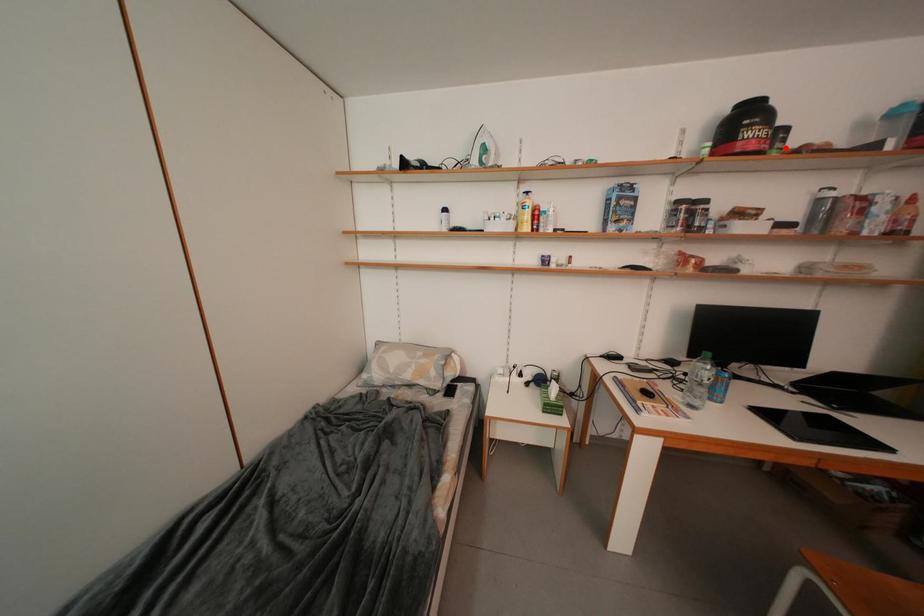
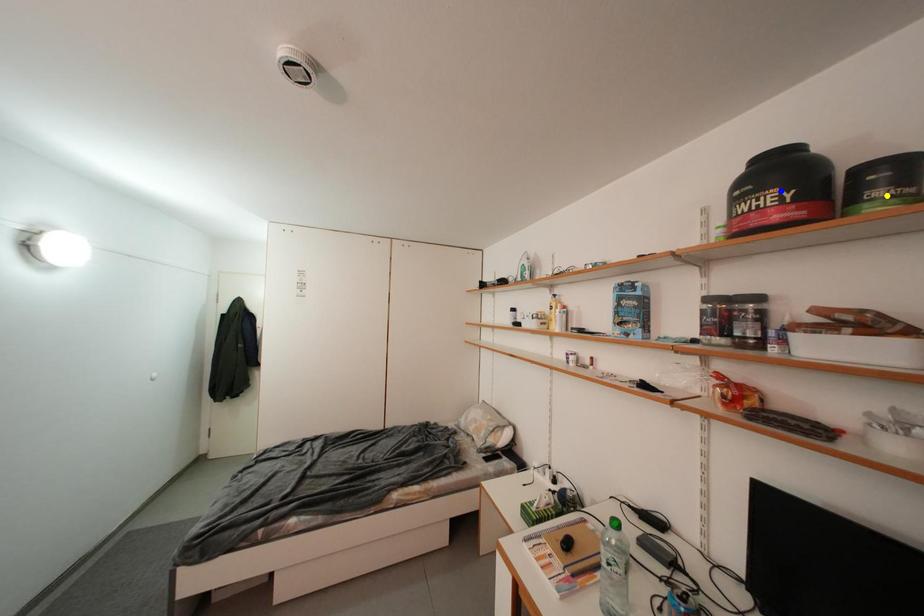
Question: I am providing you with two images of the same scene from different viewpoints. A red point is marked on the first image. You are given multiple points on the second image. Which mark in image 2 goes with the point in image 1?

Choices:
 (A) yellow point
 (B) blue point
 (C) green point

Answer: (A)